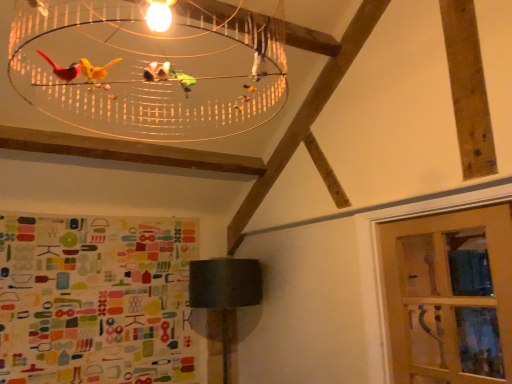
Question: Is translucent plastic birdcage at upper center placed right next to clear glass door at lower right?

Choices:
 (A) no
 (B) yes

Answer: (A)

Question: Is clear glass door at lower right completely or partially inside translucent plastic birdcage at upper center?

Choices:
 (A) yes
 (B) no

Answer: (B)

Question: Is translucent plastic birdcage at upper center not near clear glass door at lower right?

Choices:
 (A) yes
 (B) no

Answer: (A)

Question: Is translucent plastic birdcage at upper center taller than clear glass door at lower right?

Choices:
 (A) no
 (B) yes

Answer: (A)

Question: Can you confirm if translucent plastic birdcage at upper center is bigger than clear glass door at lower right?

Choices:
 (A) no
 (B) yes

Answer: (B)

Question: Considering their positions, is clear glass door at lower right located in front of or behind translucent plastic birdcage at upper center?

Choices:
 (A) front
 (B) behind

Answer: (B)

Question: From a real-world perspective, relative to translucent plastic birdcage at upper center, is clear glass door at lower right vertically above or below?

Choices:
 (A) below
 (B) above

Answer: (A)

Question: In terms of height, does clear glass door at lower right look taller or shorter compared to translucent plastic birdcage at upper center?

Choices:
 (A) short
 (B) tall

Answer: (B)

Question: Visually, is clear glass door at lower right positioned to the left or to the right of translucent plastic birdcage at upper center?

Choices:
 (A) right
 (B) left

Answer: (A)

Question: From the image's perspective, is matte black lampshade at lower center positioned above or below clear glass door at lower right?

Choices:
 (A) below
 (B) above

Answer: (A)

Question: Based on their positions, is matte black lampshade at lower center located to the left or right of clear glass door at lower right?

Choices:
 (A) left
 (B) right

Answer: (A)

Question: Does point (223, 342) appear closer or farther from the camera than point (466, 382)?

Choices:
 (A) farther
 (B) closer

Answer: (B)

Question: From their relative heights in the image, would you say matte black lampshade at lower center is taller or shorter than clear glass door at lower right?

Choices:
 (A) tall
 (B) short

Answer: (A)

Question: Is point (47, 62) positioned closer to the camera than point (394, 281)?

Choices:
 (A) closer
 (B) farther

Answer: (A)

Question: From the image's perspective, relative to clear glass door at lower right, is translucent plastic birdcage at upper center above or below?

Choices:
 (A) above
 (B) below

Answer: (A)